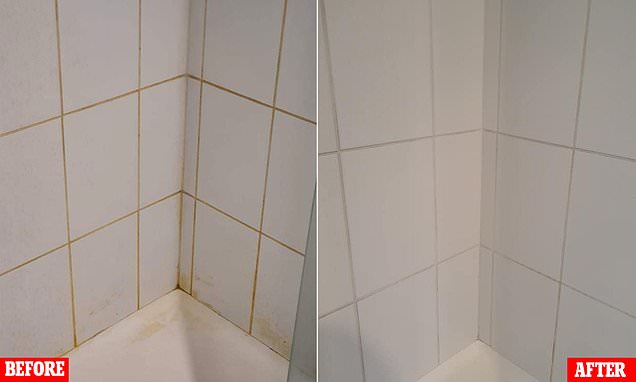
Find the location of a particular element. The image size is (636, 382). clean cubicle is located at coordinates click(472, 364).